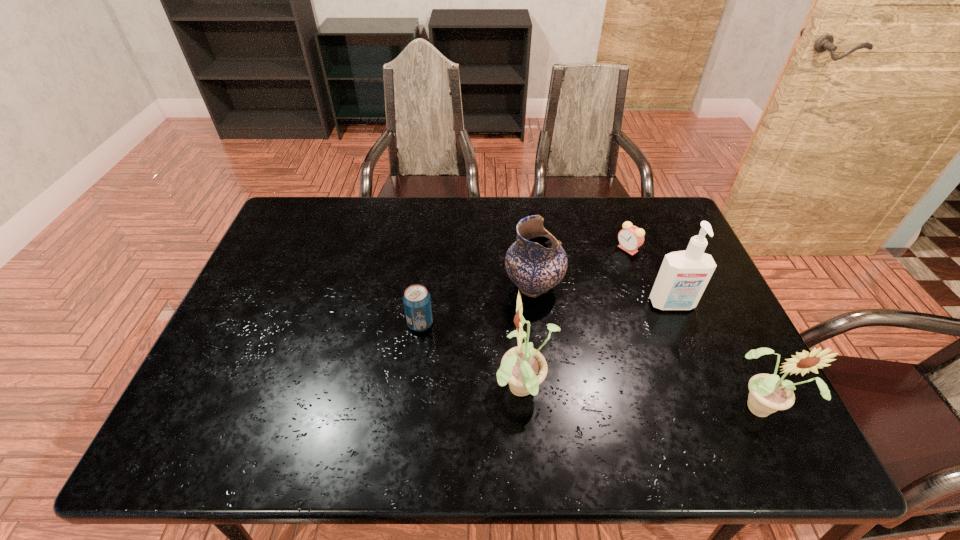
In order to click on vacant area between the taller sunflower and the shortest object in this screenshot , I will do `click(576, 320)`.

Find the location of a particular element. This screenshot has width=960, height=540. empty location between the taller sunflower and the cleansing agent is located at coordinates (598, 348).

Locate an element on the screen. The image size is (960, 540). object that can be found as the third closest to the shortest object is located at coordinates (768, 393).

Image resolution: width=960 pixels, height=540 pixels. In order to click on object that is the second closest to the shortest object in this screenshot , I will do `click(536, 262)`.

Locate an element on the screen. The height and width of the screenshot is (540, 960). vacant space that satisfies the following two spatial constraints: 1. on the front label of the cleansing agent; 2. on the front-facing side of the left sunflower is located at coordinates (707, 391).